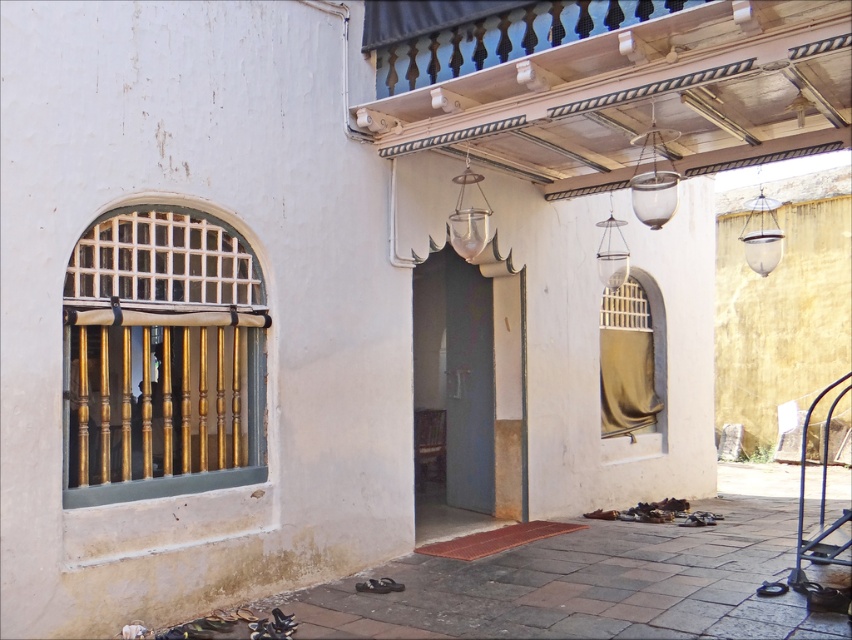
You are standing in front of the building and notice the blue metal rail at lower right and the translucent glass lantern at center. Which object is closer to you?

The blue metal rail at lower right is closer to you because it is in front of the translucent glass lantern at center.

You are a maintenance worker standing at the base of the building. You need to check both the transparent glass lamp at upper center and the camera. Which one is farther from you?

The transparent glass lamp at upper center and the camera are 8.04 meters apart from each other. Since the question doesn not specify their individual distances from you, it is impossible to determine which is farther without additional information.